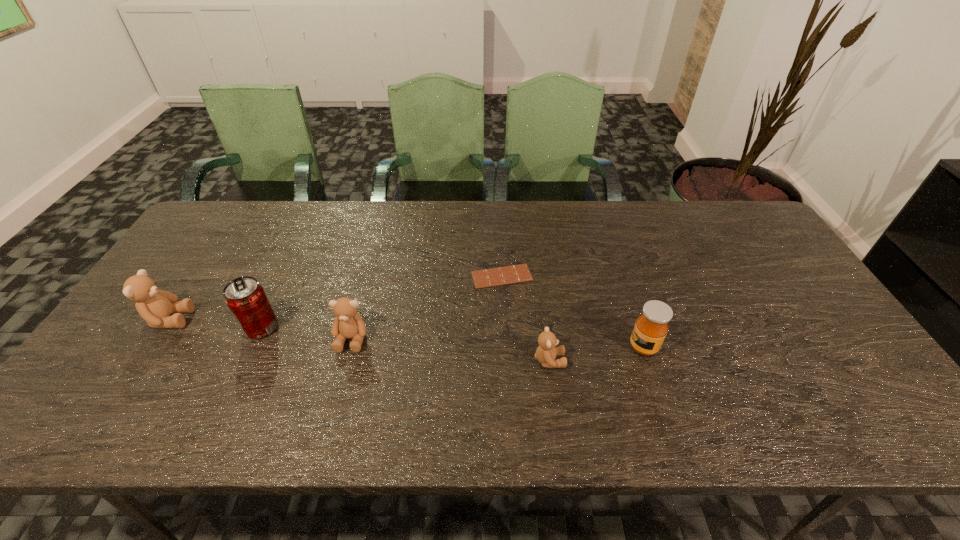
Considering the uniform spacing of teddy bears, where should an additional teddy bear be positioned on the right? Please locate a free spot. Please provide its 2D coordinates. Your answer should be formatted as a tuple, i.e. [(x, y)], where the tuple contains the x and y coordinates of a point satisfying the conditions above.

[(765, 384)]